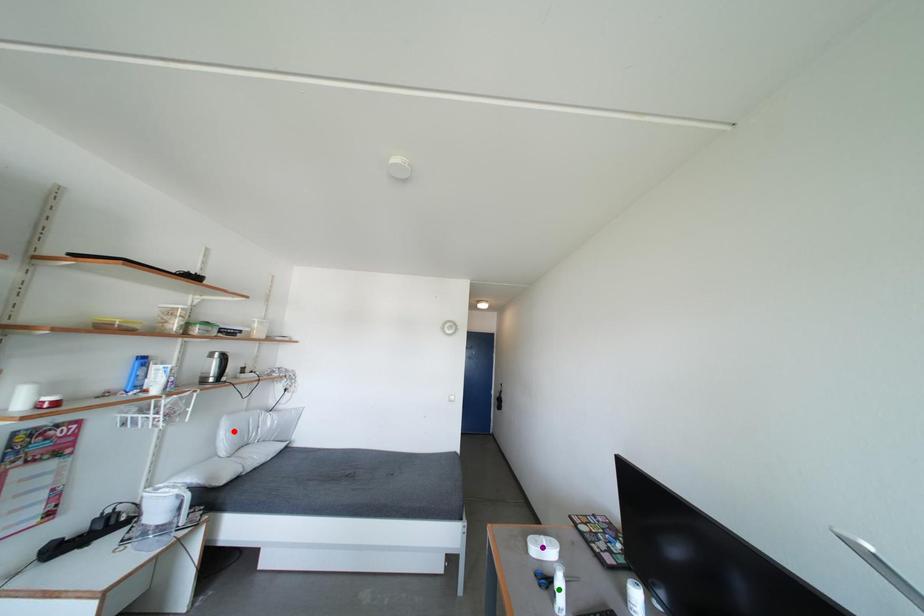
Order these from nearest to farthest:
- green point
- red point
- purple point

1. green point
2. purple point
3. red point